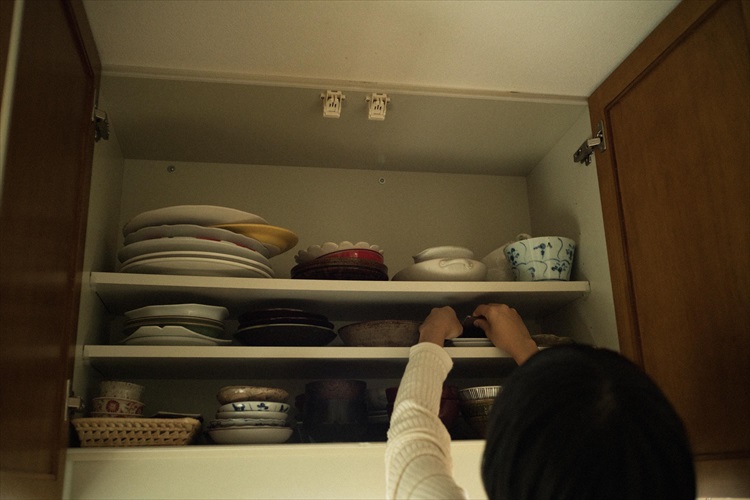
Identify the location of back of cabinet. Image resolution: width=750 pixels, height=500 pixels. (370, 208).